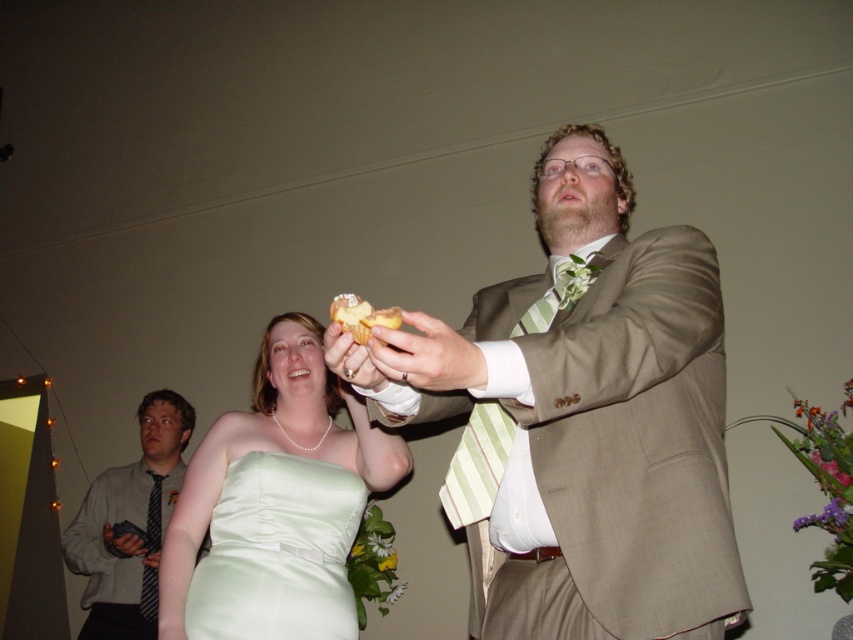
Question: Does satin green dress at center appear on the left side of gray striped tie at lower left?

Choices:
 (A) yes
 (B) no

Answer: (B)

Question: Is satin green dress at center to the left of gray striped tie at lower left from the viewer's perspective?

Choices:
 (A) yes
 (B) no

Answer: (B)

Question: Among these objects, which one is farthest from the camera?

Choices:
 (A) yellow sponge cake at center
 (B) satin green dress at center
 (C) light brown suit at center

Answer: (B)

Question: Estimate the real-world distances between objects in this image. Which object is farther from the yellow sponge cake at center?

Choices:
 (A) gray striped tie at lower left
 (B) satin green dress at center

Answer: (A)

Question: From the image, what is the correct spatial relationship of light brown suit at center in relation to satin green dress at center?

Choices:
 (A) left
 (B) right

Answer: (B)

Question: Among these points, which one is nearest to the camera?

Choices:
 (A) (149, 547)
 (B) (270, 438)
 (C) (730, 593)
 (D) (375, 317)

Answer: (D)